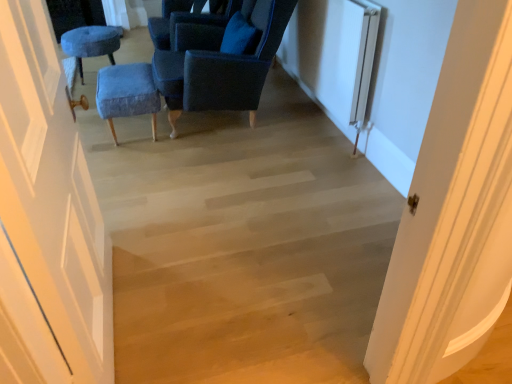
Locate an element on the screen. velvet blue chair at upper center, the second chair viewed from the front is located at coordinates (188, 19).

Find the location of `velvet blue chair at center, arranged as the 1th chair when viewed from the front`. velvet blue chair at center, arranged as the 1th chair when viewed from the front is located at coordinates coord(220,64).

Find the location of a particular element. Image resolution: width=512 pixels, height=384 pixels. white matte door at left is located at coordinates (47, 219).

Is point (49, 203) positioned in front of point (357, 50)?

That is True.

Based on their sizes in the image, would you say white matte door at left is bigger or smaller than white textured radiator at right?

In the image, white matte door at left appears to be larger than white textured radiator at right.

Between white matte door at left and white textured radiator at right, which one has larger width?

With larger width is white matte door at left.

Is velvet blue chair at upper center, the 1th chair viewed from the back, facing towards velvet blue ottoman at center, which is the 2th furniture from back to front?

No.

What's the angular difference between velvet blue chair at upper center, the second chair viewed from the front, and velvet blue ottoman at center, which is the 2th furniture from back to front,'s facing directions?

0.000316 degrees.

Which of these two, velvet blue chair at upper center, the second chair viewed from the front, or velvet blue ottoman at center, which appears as the first furniture when viewed from the right, is thinner?

Thinner between the two is velvet blue ottoman at center, which appears as the first furniture when viewed from the right.

From the image's perspective, is velvet blue chair at upper center, the 1th chair viewed from the back, below velvet blue ottoman at center, which appears as the first furniture when viewed from the right?

No.

Does white textured radiator at right have a greater height compared to white matte door at left?

Incorrect, the height of white textured radiator at right is not larger of that of white matte door at left.

From a real-world perspective, is white textured radiator at right on white matte door at left?

No.

This screenshot has width=512, height=384. What are the coordinates of `radiator above the white matte door at left (from the image's perspective)` in the screenshot? It's located at (348, 61).

Considering the positions of objects white textured radiator at right and velvet blue chair at center, arranged as the 1th chair when viewed from the front, in the image provided, who is behind, white textured radiator at right or velvet blue chair at center, arranged as the 1th chair when viewed from the front,?

velvet blue chair at center, arranged as the 1th chair when viewed from the front, is behind.

Between white textured radiator at right and velvet blue chair at center, arranged as the 1th chair when viewed from the front, which one has smaller size?

white textured radiator at right.

Is velvet blue chair at center, arranged as the 1th chair when viewed from the front, at the back of white textured radiator at right?

Yes, white textured radiator at right is positioned with its back facing velvet blue chair at center, arranged as the 1th chair when viewed from the front.

Considering the sizes of objects white textured radiator at right and velvet blue chair at center, arranged as the 1th chair when viewed from the front, in the image provided, who is shorter, white textured radiator at right or velvet blue chair at center, arranged as the 1th chair when viewed from the front,?

With less height is white textured radiator at right.

Considering the relative sizes of velvet blue ottoman at center, the 2th furniture when ordered from top to bottom, and velvet blue chair at upper center, the 1th chair viewed from the back, in the image provided, is velvet blue ottoman at center, the 2th furniture when ordered from top to bottom, bigger than velvet blue chair at upper center, the 1th chair viewed from the back,?

Incorrect, velvet blue ottoman at center, the 2th furniture when ordered from top to bottom, is not larger than velvet blue chair at upper center, the 1th chair viewed from the back.

Is velvet blue ottoman at center, placed as the 2th furniture when sorted from left to right, placed right next to velvet blue chair at upper center, the 1th chair viewed from the back?

No, velvet blue ottoman at center, placed as the 2th furniture when sorted from left to right, is not touching velvet blue chair at upper center, the 1th chair viewed from the back.

Is point (135, 64) positioned before point (150, 32)?

That is True.

Considering the relative sizes of white matte door at left and velvet blue ottoman at upper left, which is counted as the 2th furniture, starting from the front, in the image provided, is white matte door at left smaller than velvet blue ottoman at upper left, which is counted as the 2th furniture, starting from the front,?

No, white matte door at left is not smaller than velvet blue ottoman at upper left, which is counted as the 2th furniture, starting from the front.

Can you tell me how much white matte door at left and velvet blue ottoman at upper left, which ranks as the 1th furniture in left-to-right order, differ in facing direction?

The angular difference between white matte door at left and velvet blue ottoman at upper left, which ranks as the 1th furniture in left-to-right order, is 180 degrees.

Is white matte door at left to the left of velvet blue ottoman at upper left, which is counted as the 2th furniture, starting from the front, from the viewer's perspective?

No.

Consider the image. Which of these two, white matte door at left or velvet blue ottoman at upper left, which ranks as the second furniture in right-to-left order, is thinner?

white matte door at left.

Can you confirm if white matte door at left is positioned to the right of velvet blue chair at upper center, the second chair viewed from the front?

In fact, white matte door at left is to the left of velvet blue chair at upper center, the second chair viewed from the front.

Considering the relative sizes of white matte door at left and velvet blue chair at upper center, the 1th chair viewed from the back, in the image provided, is white matte door at left shorter than velvet blue chair at upper center, the 1th chair viewed from the back,?

In fact, white matte door at left may be taller than velvet blue chair at upper center, the 1th chair viewed from the back.

From the image's perspective, is white matte door at left located above or below velvet blue chair at upper center, the second chair viewed from the front?

white matte door at left is below velvet blue chair at upper center, the second chair viewed from the front.

Find the location of a particular element. radiator located above the white matte door at left (from the image's perspective) is located at coordinates (348, 61).

This screenshot has height=384, width=512. Identify the location of chair located behind the velvet blue ottoman at center, which appears as the 1th furniture when ordered from the bottom. (188, 19).

From the image, which object appears to be nearer to velvet blue chair at upper center, the second chair viewed from the front, velvet blue ottoman at upper left, arranged as the first furniture when viewed from the top, or white textured radiator at right?

Result: velvet blue ottoman at upper left, arranged as the first furniture when viewed from the top, lies closer to velvet blue chair at upper center, the second chair viewed from the front, than the other object.

Based on the photo, estimate the real-world distances between objects in this image. Which object is closer to white textured radiator at right, velvet blue ottoman at center, which is the 2th furniture from back to front, or velvet blue chair at upper center, the 1th chair viewed from the back?

The object closer to white textured radiator at right is velvet blue chair at upper center, the 1th chair viewed from the back.

Looking at the image, which one is located closer to velvet blue chair at center, placed as the second chair when sorted from back to front, white textured radiator at right or velvet blue ottoman at upper left, which ranks as the 1th furniture in left-to-right order?

Among the two, white textured radiator at right is located nearer to velvet blue chair at center, placed as the second chair when sorted from back to front.

From the image, which object appears to be nearer to white matte door at left, velvet blue chair at upper center, the second chair viewed from the front, or velvet blue ottoman at center, which appears as the first furniture when viewed from the right?

Based on the image, velvet blue ottoman at center, which appears as the first furniture when viewed from the right, appears to be nearer to white matte door at left.

Which object lies further to the anchor point velvet blue ottoman at upper left, placed as the 1th furniture when sorted from back to front, velvet blue ottoman at center, the 2th furniture when ordered from top to bottom, or velvet blue chair at center, arranged as the 1th chair when viewed from the front?

Based on the image, velvet blue chair at center, arranged as the 1th chair when viewed from the front, appears to be further to velvet blue ottoman at upper left, placed as the 1th furniture when sorted from back to front.

When comparing their distances from velvet blue ottoman at center, the 2th furniture when ordered from top to bottom, does velvet blue chair at center, arranged as the 1th chair when viewed from the front, or white textured radiator at right seem closer?

The object closer to velvet blue ottoman at center, the 2th furniture when ordered from top to bottom, is velvet blue chair at center, arranged as the 1th chair when viewed from the front.

Which object lies nearer to the anchor point white textured radiator at right, white matte door at left or velvet blue chair at upper center, the 1th chair viewed from the back?

Among the two, velvet blue chair at upper center, the 1th chair viewed from the back, is located nearer to white textured radiator at right.

Based on their spatial positions, is white textured radiator at right or velvet blue chair at center, placed as the second chair when sorted from back to front, closer to velvet blue ottoman at center, placed as the 2th furniture when sorted from left to right?

Based on the image, velvet blue chair at center, placed as the second chair when sorted from back to front, appears to be nearer to velvet blue ottoman at center, placed as the 2th furniture when sorted from left to right.

What are the coordinates of `chair between white matte door at left and velvet blue ottoman at center, positioned as the first furniture in front-to-back order, in the front-back direction` in the screenshot? It's located at (220, 64).

Image resolution: width=512 pixels, height=384 pixels. I want to click on radiator located between white matte door at left and velvet blue ottoman at upper left, which ranks as the 1th furniture in left-to-right order, in the depth direction, so click(348, 61).

Identify the location of furniture between velvet blue ottoman at upper left, the second furniture in the bottom-to-top sequence, and white textured radiator at right from left to right. (127, 93).

This screenshot has height=384, width=512. What are the coordinates of `furniture between velvet blue ottoman at upper left, placed as the 1th furniture when sorted from back to front, and velvet blue chair at center, placed as the second chair when sorted from back to front` in the screenshot? It's located at (127, 93).